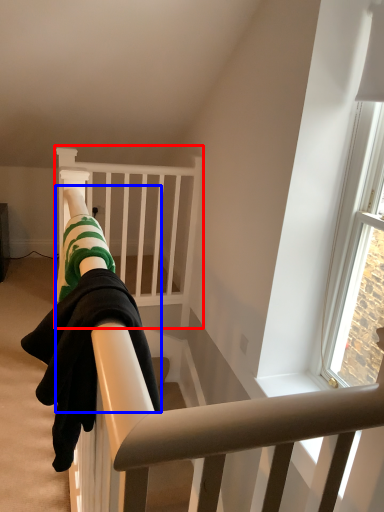
Question: Which of the following is the closest to the observer, infant bed (highlighted by a red box) or person (highlighted by a blue box)?

Choices:
 (A) infant bed
 (B) person

Answer: (B)